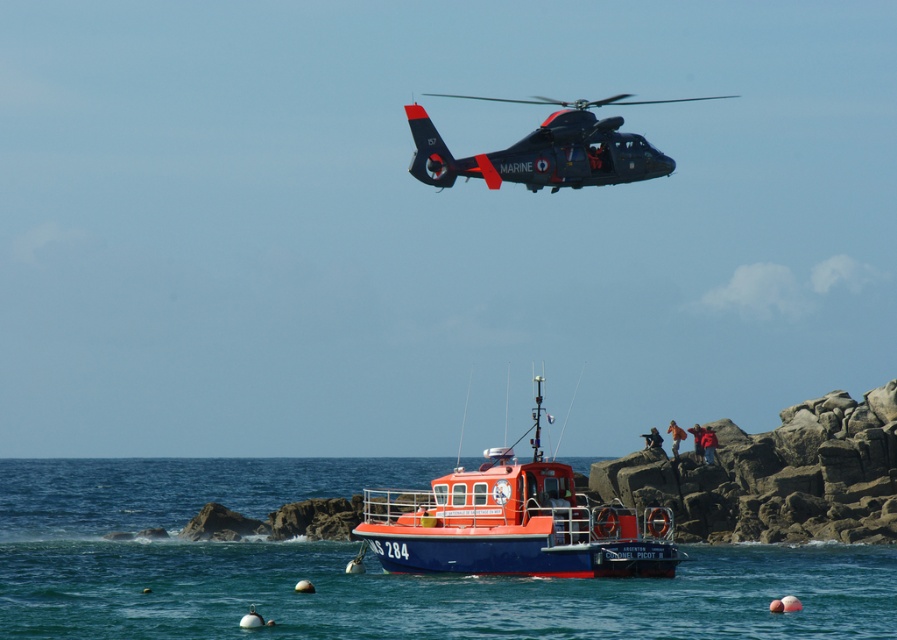
You are a passenger on the rescue boat S 284. You want to move from the blue water at boat center to the matte black helicopter at upper center. Which direction should you go to reach the helicopter?

The blue water at boat center is positioned on the left side of the matte black helicopter at upper center. To reach the helicopter, you should move to the right side from the blue water at boat center.

You are a marine observer assessing the scene. The blue water at boat center and the orange glossy boat at center are both visible. Which object occupies a larger area in the image?

The blue water at boat center is bigger than the orange glossy boat at center, so the blue water at boat center occupies a larger area in the image.